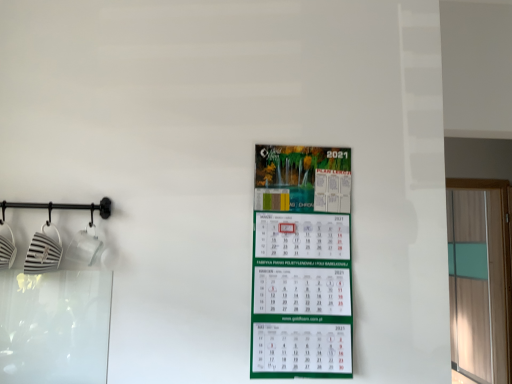
Question: Considering the relative positions of transparent glass door at right and green matte calendar at center in the image provided, is transparent glass door at right to the right of green matte calendar at center from the viewer's perspective?

Choices:
 (A) yes
 (B) no

Answer: (A)

Question: Is transparent glass door at right looking in the opposite direction of green matte calendar at center?

Choices:
 (A) no
 (B) yes

Answer: (A)

Question: Considering the relative sizes of transparent glass door at right and green matte calendar at center in the image provided, is transparent glass door at right wider than green matte calendar at center?

Choices:
 (A) yes
 (B) no

Answer: (A)

Question: From a real-world perspective, is transparent glass door at right on top of green matte calendar at center?

Choices:
 (A) no
 (B) yes

Answer: (A)

Question: Can green matte calendar at center be found inside transparent glass door at right?

Choices:
 (A) no
 (B) yes

Answer: (A)

Question: Can you confirm if transparent glass door at right is smaller than green matte calendar at center?

Choices:
 (A) no
 (B) yes

Answer: (A)

Question: Is green matte calendar at center placed right next to transparent glass door at right?

Choices:
 (A) no
 (B) yes

Answer: (A)

Question: Does green matte calendar at center lie in front of transparent glass door at right?

Choices:
 (A) yes
 (B) no

Answer: (A)

Question: Can you confirm if green matte calendar at center is shorter than transparent glass door at right?

Choices:
 (A) no
 (B) yes

Answer: (B)

Question: From the image's perspective, would you say green matte calendar at center is shown under transparent glass door at right?

Choices:
 (A) no
 (B) yes

Answer: (A)

Question: Considering the relative sizes of green matte calendar at center and transparent glass door at right in the image provided, is green matte calendar at center smaller than transparent glass door at right?

Choices:
 (A) yes
 (B) no

Answer: (A)

Question: Is green matte calendar at center further to the viewer compared to transparent glass door at right?

Choices:
 (A) yes
 (B) no

Answer: (B)

Question: Is point (456, 299) positioned closer to the camera than point (338, 273)?

Choices:
 (A) farther
 (B) closer

Answer: (A)